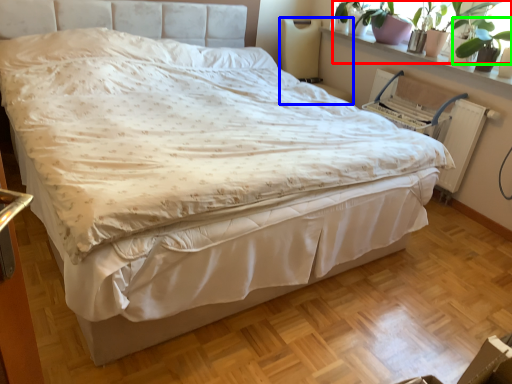
Question: Considering the real-world distances, which object is farthest from plant (highlighted by a red box)? swivel chair (highlighted by a blue box) or plant (highlighted by a green box)?

Choices:
 (A) swivel chair
 (B) plant

Answer: (A)